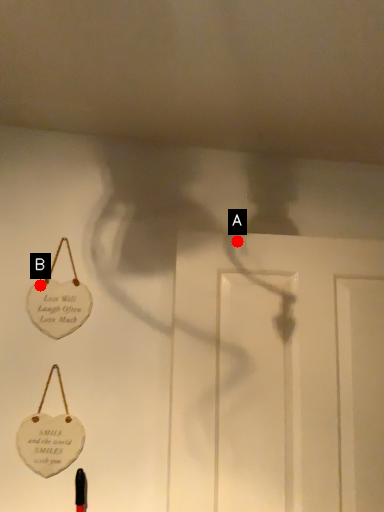
Question: Two points are circled on the image, labeled by A and B beside each circle. Which point is farther from the camera taking this photo?

Choices:
 (A) A is further
 (B) B is further

Answer: (A)